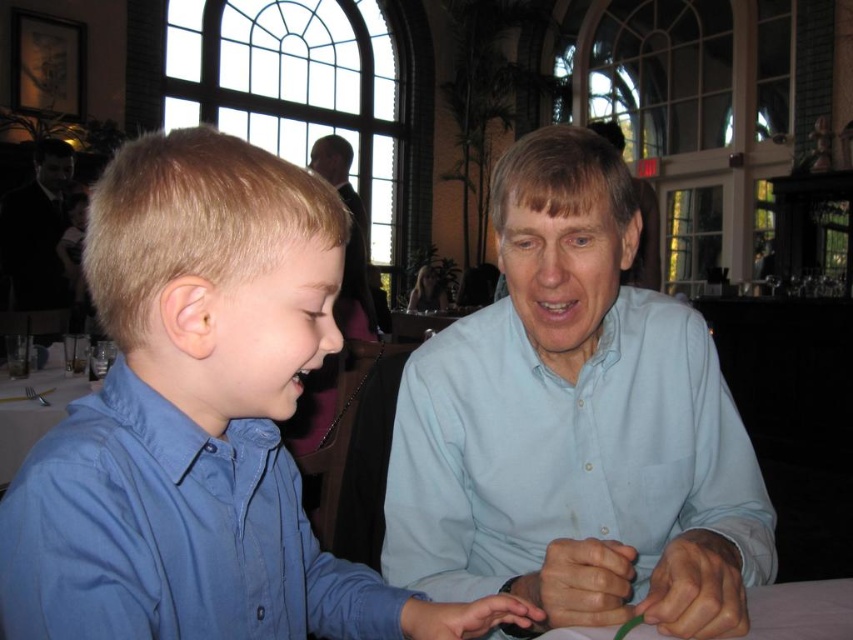
Question: Which point is closer to the camera taking this photo?

Choices:
 (A) (33, 433)
 (B) (514, 252)

Answer: (B)

Question: Is the position of blue cotton shirt at left more distant than that of light blue shirt at center?

Choices:
 (A) yes
 (B) no

Answer: (B)

Question: Is blue cotton shirt at left thinner than white glossy table at lower left?

Choices:
 (A) no
 (B) yes

Answer: (B)

Question: Which of these objects is positioned farthest from the green plastic table at center?

Choices:
 (A) light blue shirt at center
 (B) blue cotton shirt at left

Answer: (B)

Question: Does light blue shirt at center appear on the right side of dark suit at left?

Choices:
 (A) yes
 (B) no

Answer: (A)

Question: Which point appears farthest from the camera in this image?

Choices:
 (A) (503, 176)
 (B) (813, 636)
 (C) (231, 161)

Answer: (A)